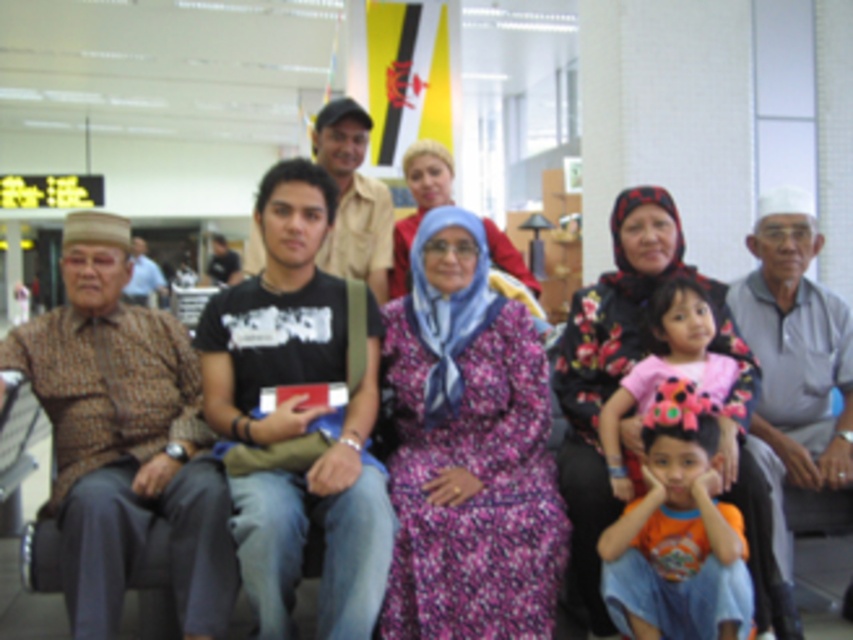
You are a photographer wanting to capture a photo of the orange cotton shirt at lower right and the purple floral dress at center. Which one should you focus on first to ensure both are in sharp focus?

The orange cotton shirt at lower right is closer to the viewer than the purple floral dress at center, so focusing on the orange cotton shirt at lower right first will help ensure both are in sharp focus since it is nearer.

In the scene shown: You are an assistant helping with seating arrangements. You need to place a rectangular cushion that is 1 meter wide between the orange cotton shirt at lower right and the pink fabric dress at center. Will the cushion fit between them?

The orange cotton shirt at lower right is narrower than the pink fabric dress at center. However, the exact distance between them isn